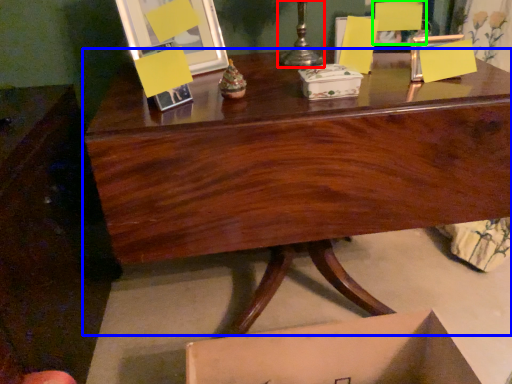
Question: Based on their relative distances, which object is nearer to candle holder (highlighted by a red box)? Choose from desk (highlighted by a blue box) and armchair (highlighted by a green box).

Choices:
 (A) desk
 (B) armchair

Answer: (B)